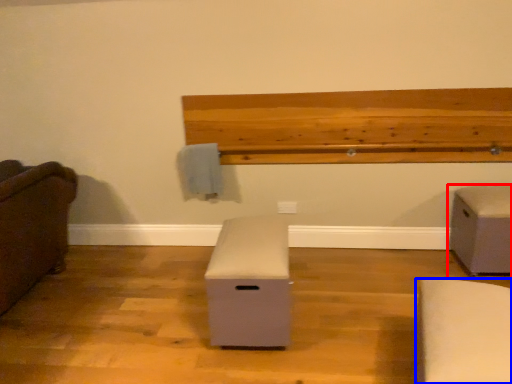
Question: Among these objects, which one is farthest to the camera, furniture (highlighted by a red box) or furniture (highlighted by a blue box)?

Choices:
 (A) furniture
 (B) furniture

Answer: (A)